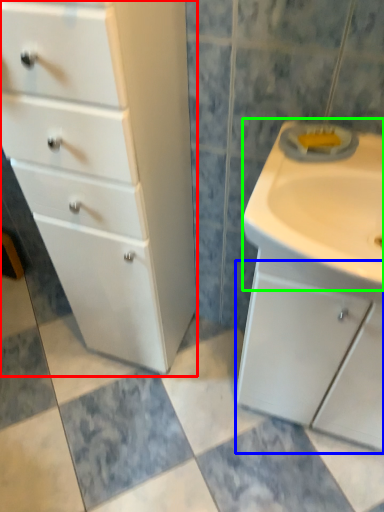
Question: Based on their relative distances, which object is farther from chest of drawers (highlighted by a red box)? Choose from cabinetry (highlighted by a blue box) and sink (highlighted by a green box).

Choices:
 (A) cabinetry
 (B) sink

Answer: (A)